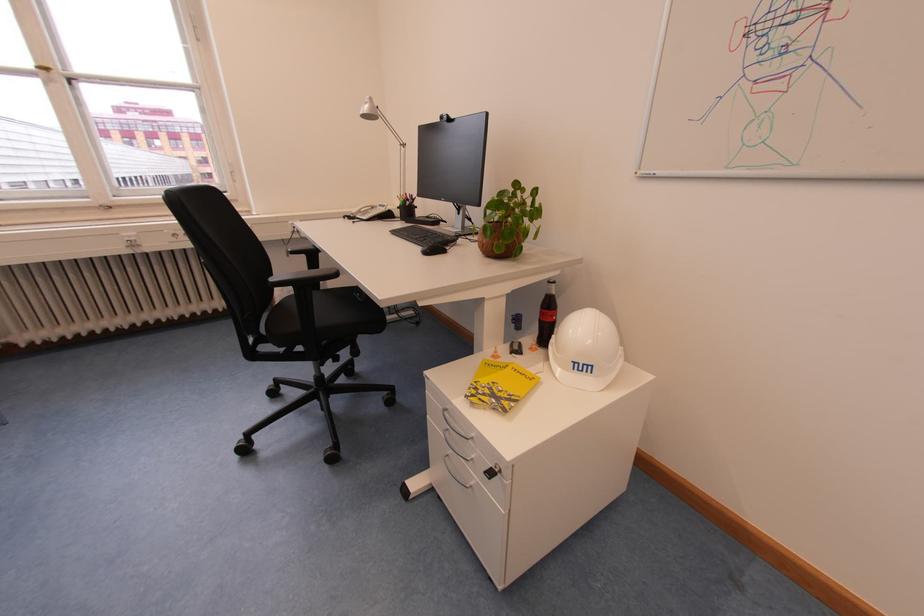
Find the location of `black chair armrest`. black chair armrest is located at coordinates (305, 253).